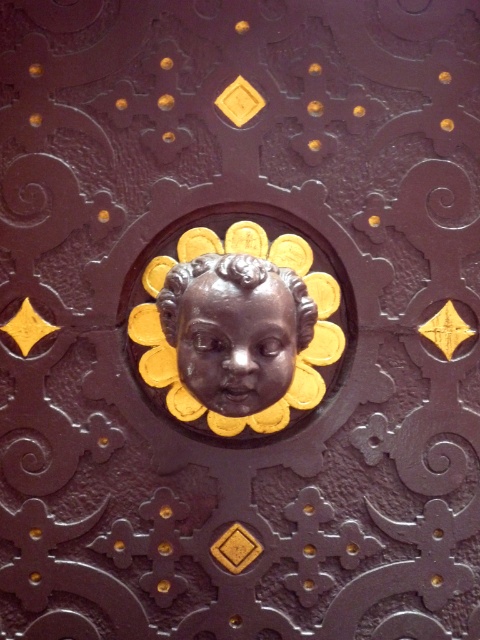
From the picture: Who is positioned more to the left, bronze statue at center or matte bronze cherub at center?

From the viewer's perspective, bronze statue at center appears more on the left side.

Between point (192, 310) and point (317, 358), which one is positioned in front?

Point (192, 310) is in front.

Is point (272, 356) farther from viewer compared to point (192, 236)?

No, (272, 356) is closer to viewer.

Find the location of a particular element. The height and width of the screenshot is (640, 480). bronze statue at center is located at coordinates pyautogui.click(x=236, y=342).